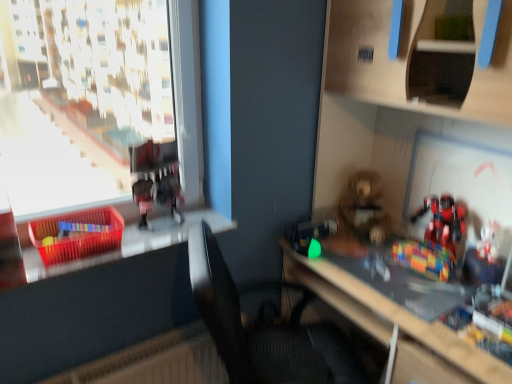
Locate an element on the screen. vacant location below metallic red robot at upper left, placed as the 1th toy when sorted from left to right (from a real-world perspective) is located at coordinates (167, 231).